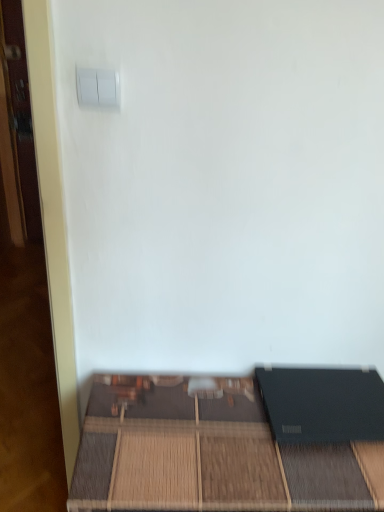
The image size is (384, 512). I want to click on free space above matte black laptop at lower right (from a real-world perspective), so click(x=215, y=433).